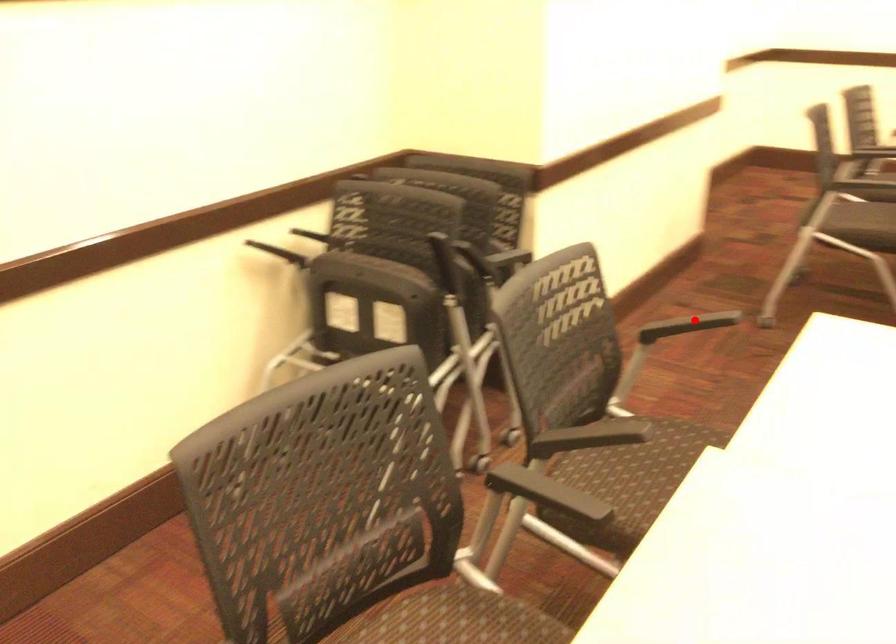
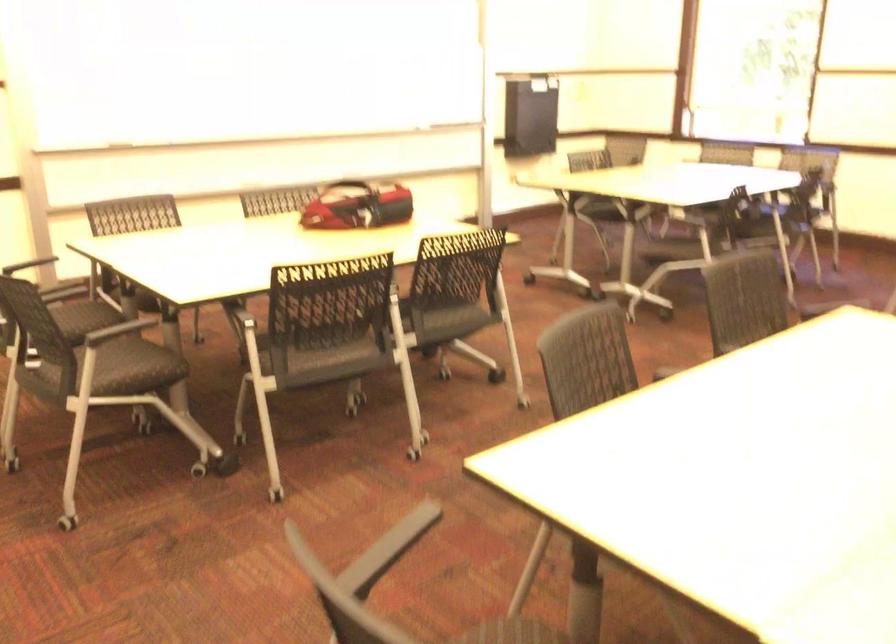
Where in the second image is the point corresponding to the highlighted location from the first image?

(389, 549)